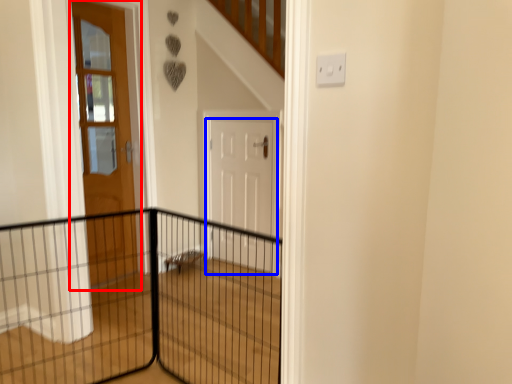
Question: Among these objects, which one is nearest to the camera, door (highlighted by a red box) or door (highlighted by a blue box)?

Choices:
 (A) door
 (B) door

Answer: (A)